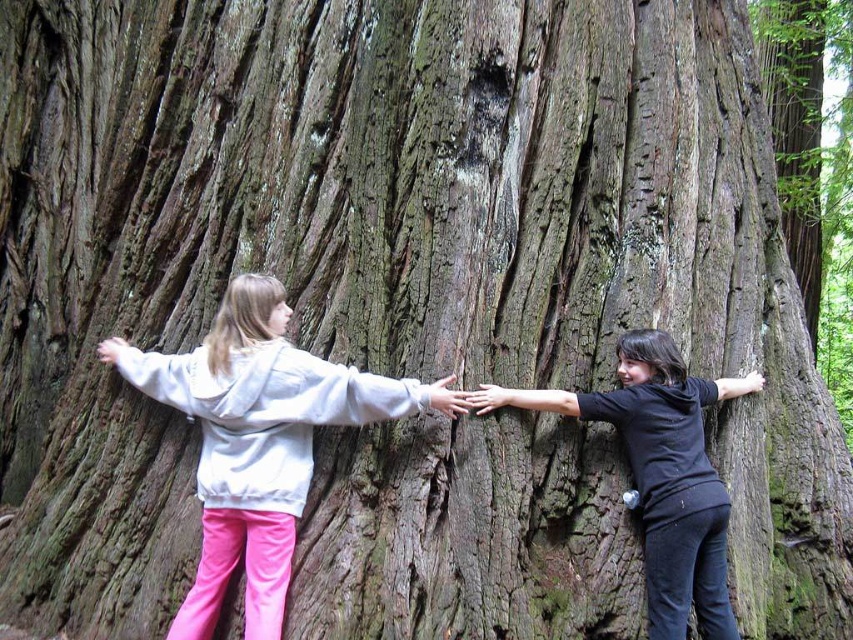
Can you confirm if smooth brown hand at center is smaller than matte brown hand at center?

No, smooth brown hand at center is not smaller than matte brown hand at center.

Is smooth brown hand at center thinner than matte brown hand at center?

No, smooth brown hand at center is not thinner than matte brown hand at center.

Between point (479, 413) and point (453, 378), which one is positioned behind?

The point (479, 413) is more distant.

This screenshot has height=640, width=853. Find the location of `smooth brown hand at center`. smooth brown hand at center is located at coordinates (492, 397).

Who is higher up, black matte shirt at right or matte brown hand at center?

matte brown hand at center

Between point (656, 413) and point (445, 380), which one is positioned in front?

Point (445, 380) is more forward.

You are a GUI agent. You are given a task and a screenshot of the screen. Output one action in this format:
    pyautogui.click(x=<x>, y=<y>)
    Task: Click on the black matte shirt at right
    
    Given the screenshot: What is the action you would take?
    pyautogui.click(x=666, y=477)

Does light gray hoodie at center come behind black matte shirt at right?

That is False.

Does point (248, 572) come farther from viewer compared to point (698, 488)?

No, it is in front of (698, 488).

At what (x,y) coordinates should I click in order to perform the action: click on light gray hoodie at center. Please return your answer as a coordinate pair (x, y). The image size is (853, 640). Looking at the image, I should click on (x=254, y=442).